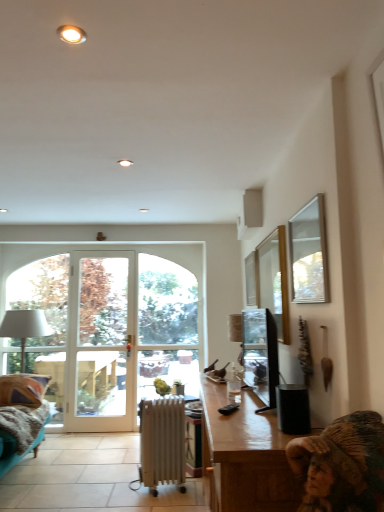
The image size is (384, 512). In order to click on free space that is to the left of white metallic radiator at center in this screenshot , I will do pos(128,493).